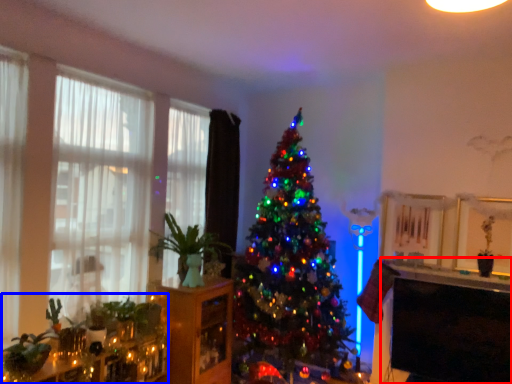
Question: Which point is closer to the camera, table (highlighted by a red box) or christmas decoration (highlighted by a blue box)?

Choices:
 (A) table
 (B) christmas decoration

Answer: (B)